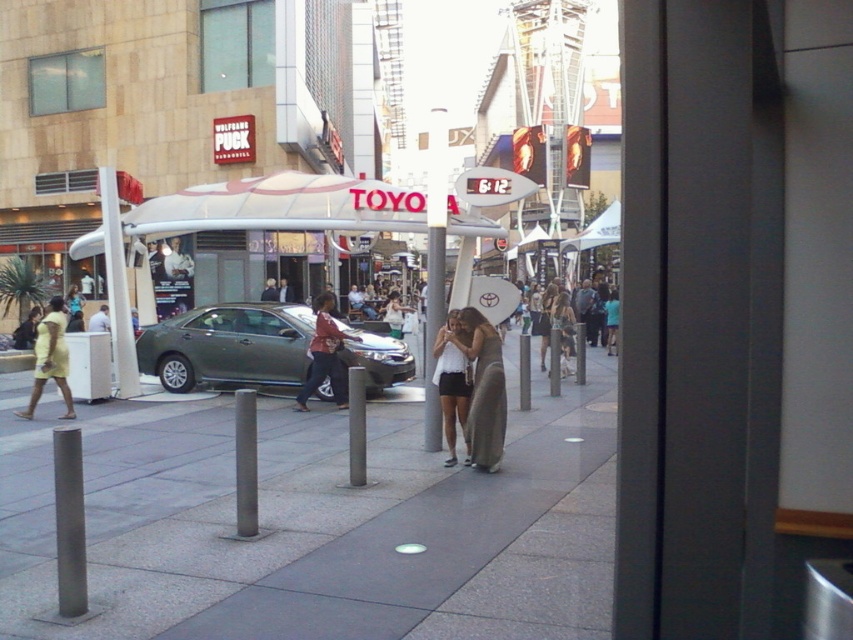
Question: Where is white matte shorts at center located in relation to satin silver pole at center in the image?

Choices:
 (A) above
 (B) below

Answer: (A)

Question: Among these points, which one is farthest from the camera?

Choices:
 (A) (158, 435)
 (B) (206, 355)
 (C) (260, 195)
 (D) (73, 556)

Answer: (C)

Question: Does white plastic pole at center appear under matte brown dress at center?

Choices:
 (A) yes
 (B) no

Answer: (B)

Question: Can you confirm if white glossy pole at center is positioned below white cotton shirt at center?

Choices:
 (A) no
 (B) yes

Answer: (A)

Question: Which point is farther to the camera?

Choices:
 (A) (434, 230)
 (B) (450, 348)
 (C) (54, 310)
 (D) (332, 324)

Answer: (D)

Question: Which object is closer to the camera taking this photo?

Choices:
 (A) white matte shorts at center
 (B) smooth gray pole at center
 (C) satin silver pole at center
 (D) white cotton shirt at center

Answer: (C)